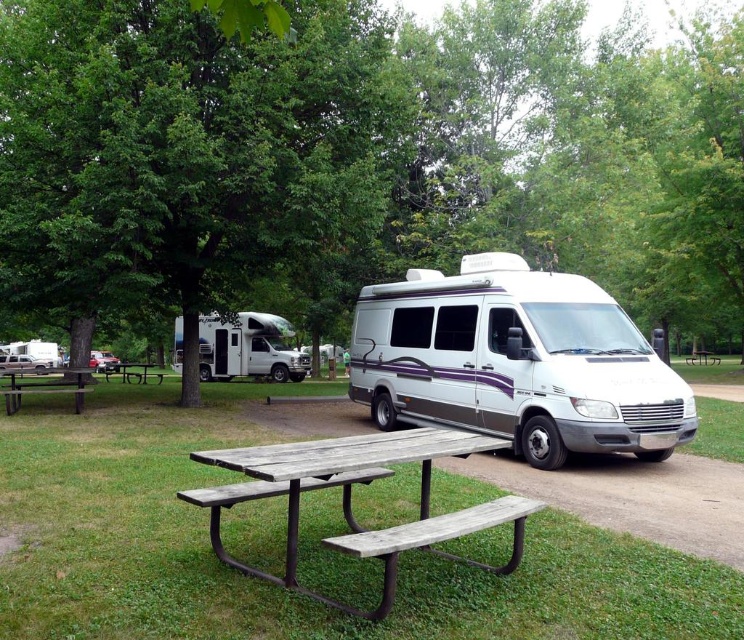
Consider the image. Does weathered wood picnic table at center have a greater width compared to wooden picnic table at lower left?

Indeed, weathered wood picnic table at center has a greater width compared to wooden picnic table at lower left.

Which is more to the right, weathered wood picnic table at center or wooden picnic table at lower left?

weathered wood picnic table at center is more to the right.

At what (x,y) coordinates should I click in order to perform the action: click on weathered wood picnic table at center. Please return your answer as a coordinate pair (x, y). The image size is (744, 640). Looking at the image, I should click on coord(349,499).

Is weathered wood picnic table at center positioned in front of weathered wood bench at lower center?

No.

Is weathered wood picnic table at center to the right of weathered wood bench at lower center from the viewer's perspective?

Incorrect, weathered wood picnic table at center is not on the right side of weathered wood bench at lower center.

Which is in front, point (429, 448) or point (426, 544)?

Point (426, 544)

Where is `weathered wood picnic table at center`? weathered wood picnic table at center is located at coordinates (349, 499).

What are the coordinates of `weathered wood bench at lower center` in the screenshot? It's located at (434, 540).

Between point (350, 536) and point (347, 490), which one is positioned in front?

Point (350, 536) is in front.

Describe the element at coordinates (434, 540) in the screenshot. I see `weathered wood bench at lower center` at that location.

Identify the location of weathered wood bench at lower center. The image size is (744, 640). (434, 540).